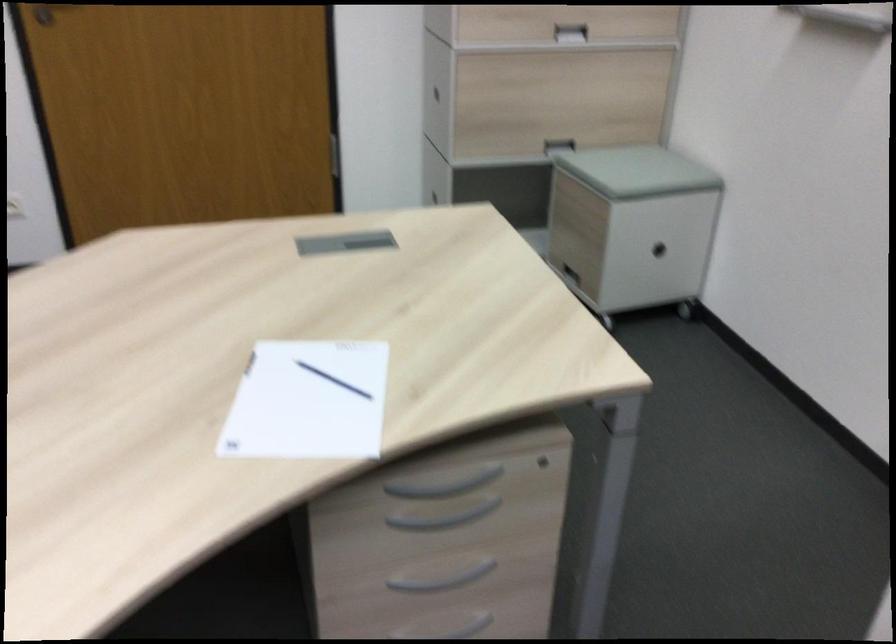
This screenshot has width=896, height=644. I want to click on cabinet bar handle, so click(557, 146).